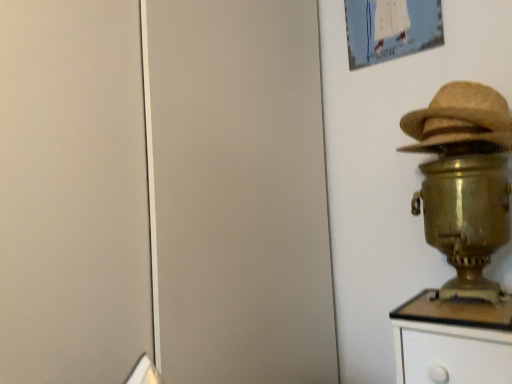
At what (x,y) coordinates should I click in order to perform the action: click on gold metallic samovar at right. Please return your answer as a coordinate pair (x, y). The height and width of the screenshot is (384, 512). Looking at the image, I should click on (464, 181).

In order to face gold metallic samovar at right, should I rotate leftwards or rightwards?

You should look right and rotate roughly 25.567 degrees.

Describe the element at coordinates (391, 29) in the screenshot. The image size is (512, 384). I see `matte paper picture frame at upper right` at that location.

The height and width of the screenshot is (384, 512). In order to click on matte paper picture frame at upper right in this screenshot , I will do `click(391, 29)`.

At what (x,y) coordinates should I click in order to perform the action: click on gold metallic samovar at right. Please return your answer as a coordinate pair (x, y). This screenshot has height=384, width=512. Looking at the image, I should click on (464, 181).

How far apart are matte paper picture frame at upper right and gold metallic samovar at right?

A distance of 18.60 inches exists between matte paper picture frame at upper right and gold metallic samovar at right.

Could you tell me if matte paper picture frame at upper right is facing gold metallic samovar at right?

No, matte paper picture frame at upper right is not turned towards gold metallic samovar at right.

Would you say matte paper picture frame at upper right is a long distance from gold metallic samovar at right?

Actually, matte paper picture frame at upper right and gold metallic samovar at right are a little close together.

In the scene shown: From a real-world perspective, between gold metallic samovar at right and braided straw hat at right, who is vertically lower?

gold metallic samovar at right, from a real-world perspective.

From the image's perspective, is gold metallic samovar at right above braided straw hat at right?

No, from the image's perspective, gold metallic samovar at right is not above braided straw hat at right.

Is gold metallic samovar at right further to the viewer compared to braided straw hat at right?

No, gold metallic samovar at right is closer to the viewer.

Measure the distance from gold metallic samovar at right to braided straw hat at right.

gold metallic samovar at right and braided straw hat at right are 2.95 inches apart.

Who is more distant, braided straw hat at right or gold metallic samovar at right?

braided straw hat at right.

Which of these two, braided straw hat at right or gold metallic samovar at right, is thinner?

braided straw hat at right.

From the image's perspective, is braided straw hat at right located above or below gold metallic samovar at right?

braided straw hat at right is above gold metallic samovar at right.

Looking at this image, considering the relative positions of braided straw hat at right and gold metallic samovar at right in the image provided, is braided straw hat at right to the left or to the right of gold metallic samovar at right?

In the image, braided straw hat at right appears on the right side of gold metallic samovar at right.

How many degrees apart are the facing directions of matte paper picture frame at upper right and braided straw hat at right?

They differ by 6.51 degrees in their facing directions.

Is matte paper picture frame at upper right next to braided straw hat at right and touching it?

matte paper picture frame at upper right and braided straw hat at right are not in contact.

Is matte paper picture frame at upper right positioned with its back to braided straw hat at right?

matte paper picture frame at upper right is not turned away from braided straw hat at right.

Does point (358, 33) come in front of point (467, 98)?

No, (358, 33) is behind (467, 98).

From the image's perspective, is gold metallic samovar at right located above or below matte paper picture frame at upper right?

gold metallic samovar at right is situated lower than matte paper picture frame at upper right in the image.

Which object is closer to the camera, gold metallic samovar at right or matte paper picture frame at upper right?

gold metallic samovar at right.

This screenshot has height=384, width=512. In order to click on picture frame above the gold metallic samovar at right (from the image's perspective) in this screenshot , I will do `click(391, 29)`.

From a real-world perspective, which is physically below, gold metallic samovar at right or matte paper picture frame at upper right?

gold metallic samovar at right.

Locate an element on the screen. hat below the matte paper picture frame at upper right (from the image's perspective) is located at coordinates pyautogui.click(x=460, y=121).

Which is behind, braided straw hat at right or matte paper picture frame at upper right?

matte paper picture frame at upper right is behind.

How different are the orientations of braided straw hat at right and matte paper picture frame at upper right in degrees?

braided straw hat at right and matte paper picture frame at upper right are facing 6.51 degrees away from each other.

Can you confirm if braided straw hat at right is thinner than matte paper picture frame at upper right?

No, braided straw hat at right is not thinner than matte paper picture frame at upper right.

Locate an element on the screen. This screenshot has width=512, height=384. table lamp on the right side of matte paper picture frame at upper right is located at coordinates (464, 181).

Where is `table lamp below the braided straw hat at right (from the image's perspective)`? The height and width of the screenshot is (384, 512). table lamp below the braided straw hat at right (from the image's perspective) is located at coordinates (464, 181).

From the image, which object appears to be farther from matte paper picture frame at upper right, braided straw hat at right or gold metallic samovar at right?

gold metallic samovar at right is positioned further to the anchor matte paper picture frame at upper right.

When comparing their distances from gold metallic samovar at right, does braided straw hat at right or matte paper picture frame at upper right seem further?

matte paper picture frame at upper right is positioned further to the anchor gold metallic samovar at right.

Looking at the image, which one is located further to matte paper picture frame at upper right, gold metallic samovar at right or braided straw hat at right?

The object further to matte paper picture frame at upper right is gold metallic samovar at right.

Estimate the real-world distances between objects in this image. Which object is further from braided straw hat at right, gold metallic samovar at right or matte paper picture frame at upper right?

Based on the image, matte paper picture frame at upper right appears to be further to braided straw hat at right.

Considering their positions, is matte paper picture frame at upper right positioned closer to braided straw hat at right than gold metallic samovar at right?

Based on the image, gold metallic samovar at right appears to be nearer to braided straw hat at right.

Considering their positions, is matte paper picture frame at upper right positioned further to gold metallic samovar at right than braided straw hat at right?

The object further to gold metallic samovar at right is matte paper picture frame at upper right.

You are a GUI agent. You are given a task and a screenshot of the screen. Output one action in this format:
    pyautogui.click(x=<x>, y=<y>)
    Task: Click on the hat between matte paper picture frame at upper right and gold metallic samovar at right from top to bottom
    Image resolution: width=512 pixels, height=384 pixels.
    Given the screenshot: What is the action you would take?
    pyautogui.click(x=460, y=121)